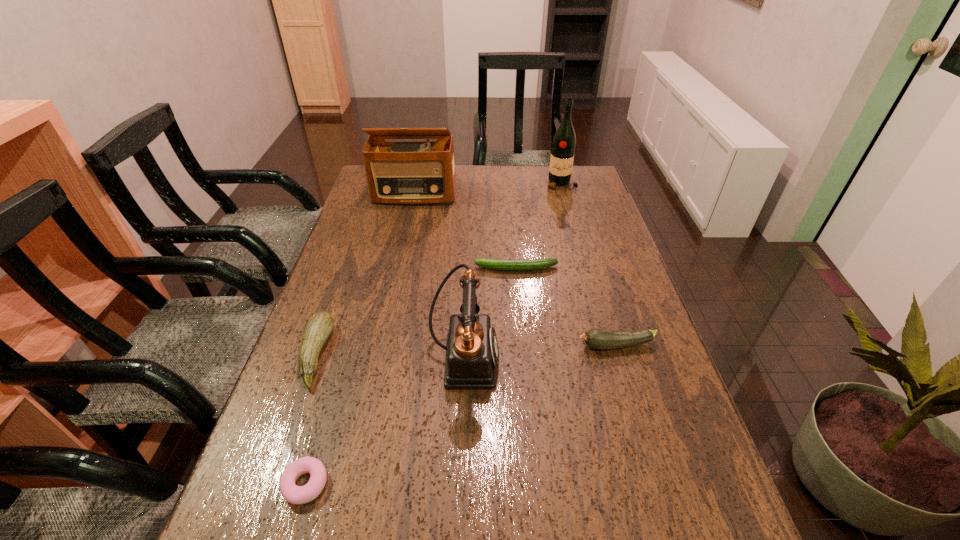
The width and height of the screenshot is (960, 540). I want to click on free space located 0.130m on the back of the nearest object, so click(330, 402).

I want to click on wine bottle present at the far edge, so click(x=563, y=145).

Where is `radio receiver that is at the far edge`? This screenshot has height=540, width=960. radio receiver that is at the far edge is located at coordinates (398, 172).

Where is `radio receiver located in the left edge section of the desktop`? radio receiver located in the left edge section of the desktop is located at coordinates (398, 172).

You are a GUI agent. You are given a task and a screenshot of the screen. Output one action in this format:
    pyautogui.click(x=<x>, y=<y>)
    Task: Click on the zucchini that is positioned at the left edge
    This screenshot has height=540, width=960.
    Given the screenshot: What is the action you would take?
    pyautogui.click(x=321, y=324)

The width and height of the screenshot is (960, 540). I want to click on pastry located at the left edge, so click(294, 494).

You are a GUI agent. You are given a task and a screenshot of the screen. Output one action in this format:
    pyautogui.click(x=<x>, y=<y>)
    Task: Click on the wine bottle positioned at the right edge
    This screenshot has width=960, height=540.
    Given the screenshot: What is the action you would take?
    pyautogui.click(x=563, y=145)

I want to click on zucchini that is positioned at the right edge, so click(x=602, y=339).

Where is `object at the far left corner`? This screenshot has height=540, width=960. object at the far left corner is located at coordinates (398, 172).

Image resolution: width=960 pixels, height=540 pixels. In order to click on object present at the far right corner in this screenshot , I will do `click(563, 145)`.